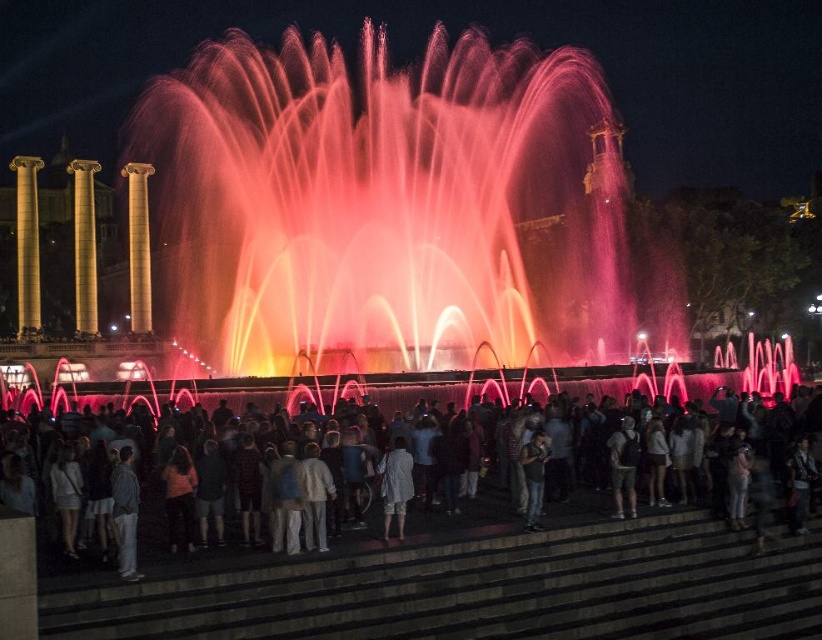
Describe the element at coordinates (483, 589) in the screenshot. I see `dark gray concrete stairs at lower center` at that location.

Which is in front, point (580, 628) or point (386, 534)?

Positioned in front is point (580, 628).

Find the location of `dark gray concrete stairs at lower center`. dark gray concrete stairs at lower center is located at coordinates (483, 589).

Is matte white crowd at lower center taller than gold polished column at left?

No, matte white crowd at lower center is not taller than gold polished column at left.

Who is taller, matte white crowd at lower center or gold polished column at left?

gold polished column at left is taller.

Is point (345, 531) behind point (93, 298)?

No, (345, 531) is closer to viewer.

Where is `matte white crowd at lower center`? matte white crowd at lower center is located at coordinates (202, 468).

Is shimmering pink water at center taller than yellow polished stone column at left?

Indeed, shimmering pink water at center has a greater height compared to yellow polished stone column at left.

Can you confirm if shimmering pink water at center is wider than yellow polished stone column at left?

Indeed, shimmering pink water at center has a greater width compared to yellow polished stone column at left.

The height and width of the screenshot is (640, 822). Find the location of `shimmering pink water at center`. shimmering pink water at center is located at coordinates (389, 208).

Find the location of a particular element. The height and width of the screenshot is (640, 822). shimmering pink water at center is located at coordinates (389, 208).